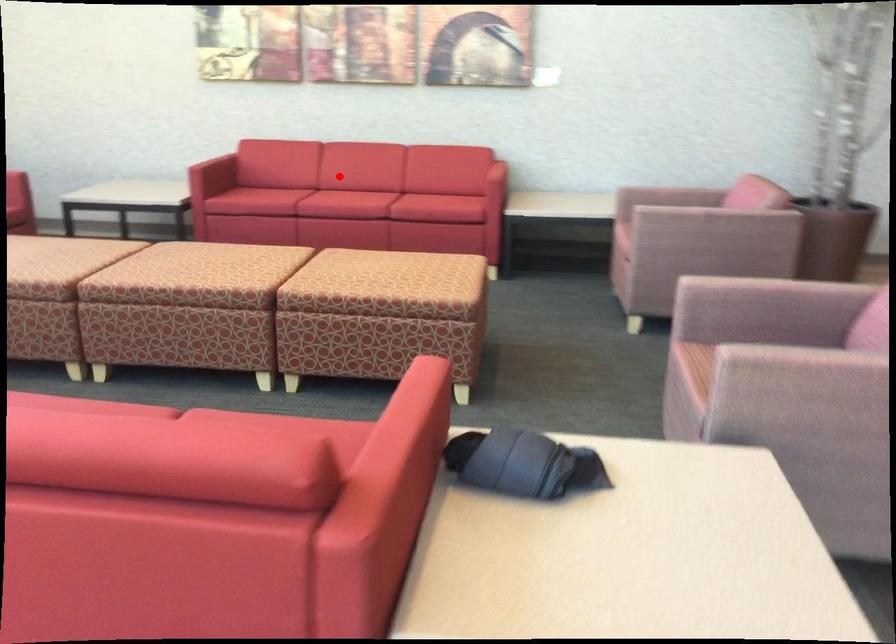
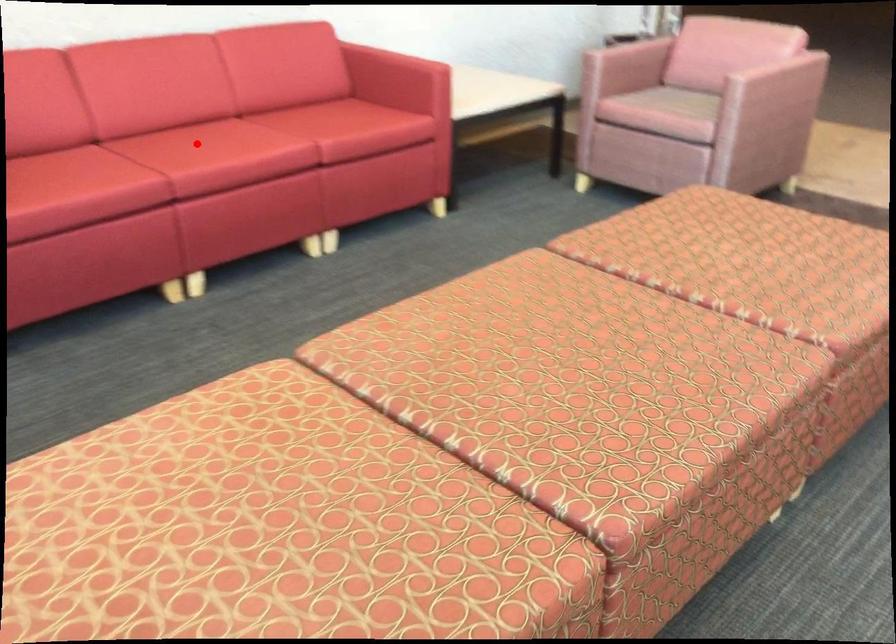
I am providing you with two images of the same scene from different viewpoints. A red point is marked on the first image and another point is marked on the second image. Do the highlighted points in image1 and image2 indicate the same real-world spot?

Yes